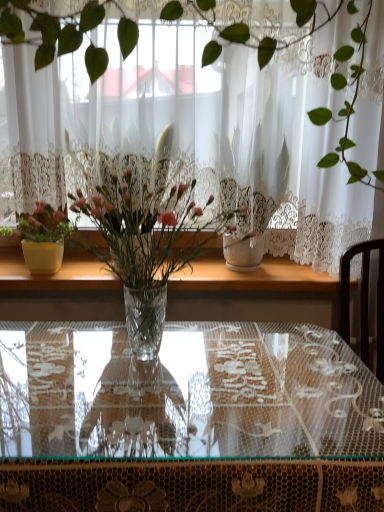
Question: Considering the positions of transparent glass table at center and clear glass vase at center, which appears as the first houseplant when viewed from the front, in the image, is transparent glass table at center wider or thinner than clear glass vase at center, which appears as the first houseplant when viewed from the front,?

Choices:
 (A) thin
 (B) wide

Answer: (B)

Question: Visually, is transparent glass table at center positioned to the left or to the right of clear glass vase at center, which is the 1th houseplant from right to left?

Choices:
 (A) left
 (B) right

Answer: (B)

Question: Considering the real-world distances, which object is closest to the white lace curtain at center?

Choices:
 (A) matte yellow pot at left, marked as the 1th houseplant in a left-to-right arrangement
 (B) clear wood window sill at center
 (C) clear glass vase at center, which is the 2th houseplant in back-to-front order
 (D) transparent glass table at center

Answer: (C)

Question: Which is farther from the matte yellow pot at left, marked as the 1th houseplant in a left-to-right arrangement?

Choices:
 (A) clear glass vase at center, which is the 2th houseplant in back-to-front order
 (B) white lace curtain at center
 (C) transparent glass table at center
 (D) clear wood window sill at center

Answer: (B)